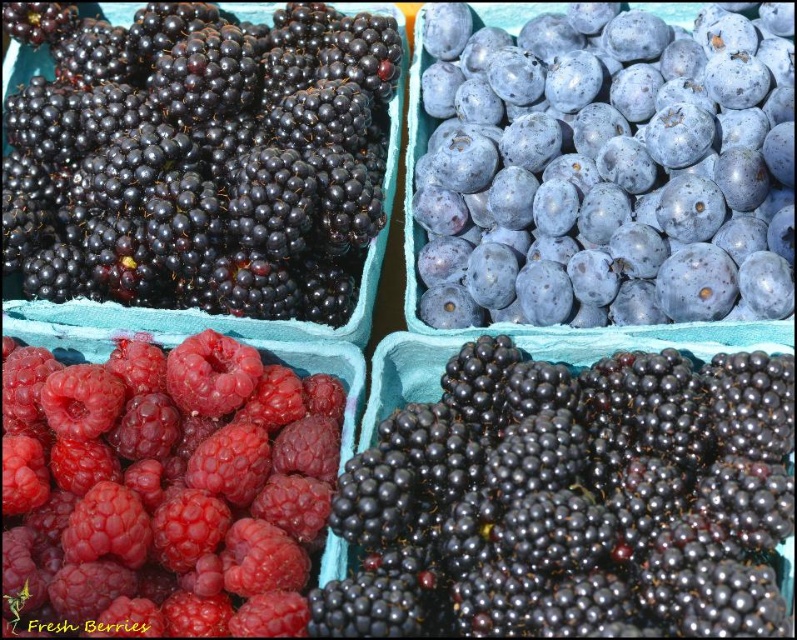
Who is higher up, shiny black grapes at center or shiny black berries at upper left?

shiny black berries at upper left is above.

Does shiny black grapes at center appear over shiny black berries at upper left?

No, shiny black grapes at center is not above shiny black berries at upper left.

Which is in front, point (669, 413) or point (159, 244)?

Point (669, 413) is more forward.

Where is `shiny black grapes at center`? The image size is (797, 640). shiny black grapes at center is located at coordinates (571, 499).

Does glossy red raspberry at lower left have a larger size compared to shiny black berries at upper left?

Incorrect, glossy red raspberry at lower left is not larger than shiny black berries at upper left.

Does glossy red raspberry at lower left appear on the left side of shiny black berries at upper left?

In fact, glossy red raspberry at lower left is to the right of shiny black berries at upper left.

Find the location of a particular element. glossy red raspberry at lower left is located at coordinates (165, 486).

Does blue matte blueberry at upper right have a lesser height compared to shiny black berries at upper left?

In fact, blue matte blueberry at upper right may be taller than shiny black berries at upper left.

Is blue matte blueberry at upper right to the right of shiny black berries at upper left from the viewer's perspective?

Correct, you'll find blue matte blueberry at upper right to the right of shiny black berries at upper left.

Find the location of `blue matte blueberry at upper right`. blue matte blueberry at upper right is located at coordinates (603, 168).